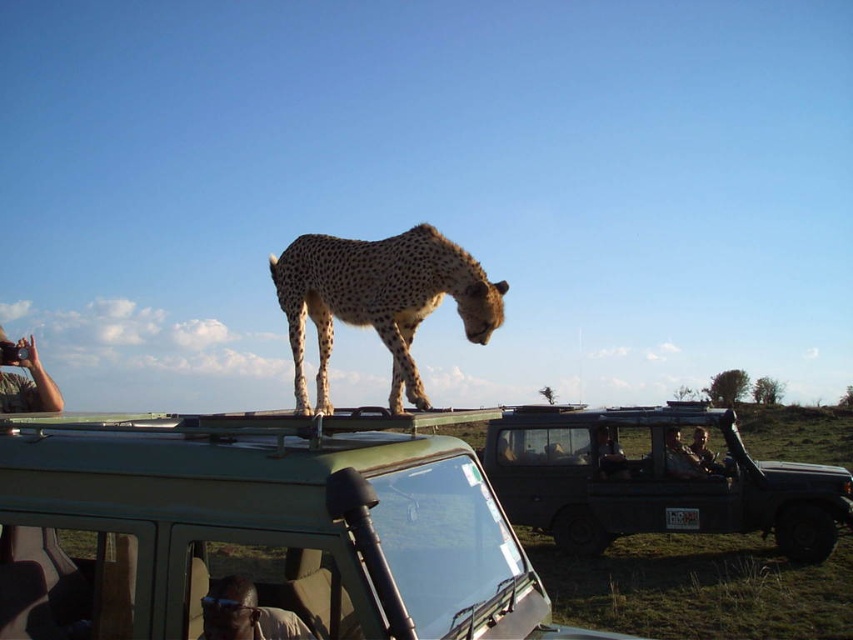
Consider the image. You are a passenger in the green safari vehicle with an open roof. You notice the spotted fur cheetah at center. Where exactly is the cheetah positioned relative to the vehicle?

The spotted fur cheetah at center is located at point 0.469 along the horizontal axis and 0.445 along the vertical axis relative to the vehicle.

You are a passenger in the green safari vehicle and want to take a photo of the cheetah on the roof. There are two points marked on the vehicle roof where you can stand. The first point is at coordinate point (747, 481) and the second is at point (297, 371). Which point should you choose to ensure you are standing behind the cheetah to take the photo?

You should choose point (297, 371) because point (747, 481) is behind point (297, 371), meaning the cheetah would block your view from the first point.